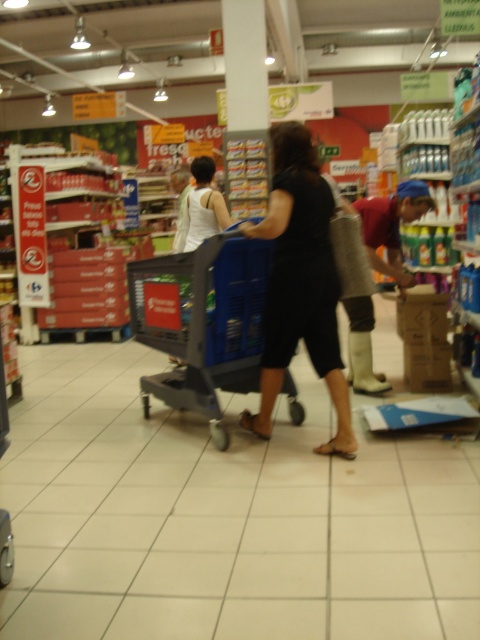
You are a customer in the supermarket and you want to pick up the white tank top at center. Which side of the blue plastic trolley at center should you go around to reach it?

The white tank top at center is on the left side of the blue plastic trolley at center, so you should go around the left side of the blue plastic trolley at center to reach it.

You are a store employee who needs to place a new sign on the blue plastic trolley at center. However, you notice the white tank top at center is currently blocking access to the trolley. Based on their sizes, which item should you move first to reach the trolley?

The blue plastic trolley at center is much taller than the white tank top at center, so you should move the white tank top at center first to access the trolley.